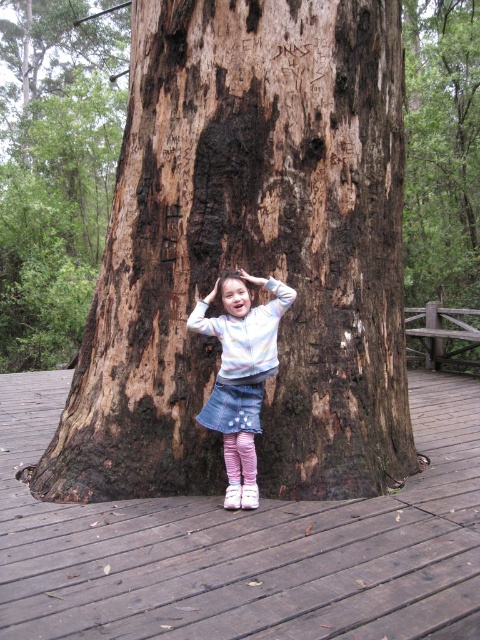
Question: Does brown rough tree trunk at center appear on the left side of wooden at lower center?

Choices:
 (A) yes
 (B) no

Answer: (B)

Question: Does wooden at lower center lie in front of denim skirt at center?

Choices:
 (A) yes
 (B) no

Answer: (A)

Question: Which object appears closest to the camera in this image?

Choices:
 (A) brown rough tree trunk at center
 (B) wooden at lower center

Answer: (B)

Question: Estimate the real-world distances between objects in this image. Which object is closer to the wooden at lower center?

Choices:
 (A) brown rough tree trunk at center
 (B) denim skirt at center

Answer: (B)

Question: Can you confirm if wooden at lower center is positioned below denim skirt at center?

Choices:
 (A) yes
 (B) no

Answer: (A)

Question: Estimate the real-world distances between objects in this image. Which object is closer to the denim skirt at center?

Choices:
 (A) brown rough tree trunk at center
 (B) wooden at lower center

Answer: (A)